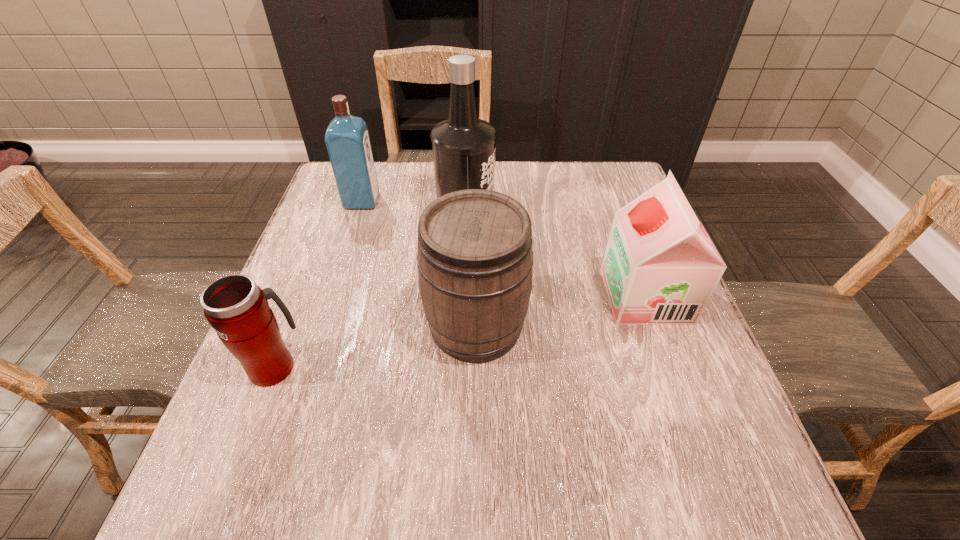
Image resolution: width=960 pixels, height=540 pixels. I want to click on vacant region at the near edge of the desktop, so coord(612,482).

Image resolution: width=960 pixels, height=540 pixels. Identify the location of vacant area at the left edge. (364, 257).

In the image, there is a desktop. Where is `vacant space at the right edge`? vacant space at the right edge is located at coordinates (683, 433).

I want to click on vacant space at the near left corner of the desktop, so click(298, 475).

I want to click on vacant space at the far right corner of the desktop, so click(585, 173).

Where is `blank region between the shortest object and the left liquor`? This screenshot has height=540, width=960. blank region between the shortest object and the left liquor is located at coordinates (319, 284).

At what (x,y) coordinates should I click in order to perform the action: click on empty space that is in between the soya milk and the wine bucket. Please return your answer as a coordinate pair (x, y). Image resolution: width=960 pixels, height=540 pixels. Looking at the image, I should click on (561, 310).

Identify the location of vacant area that lies between the left liquor and the shortest object. This screenshot has height=540, width=960. (319, 284).

Locate an element on the screen. The height and width of the screenshot is (540, 960). blank region between the taller liquor and the rightmost object is located at coordinates (556, 255).

This screenshot has height=540, width=960. In order to click on vacant area between the wine bucket and the rightmost object in this screenshot , I will do `click(561, 310)`.